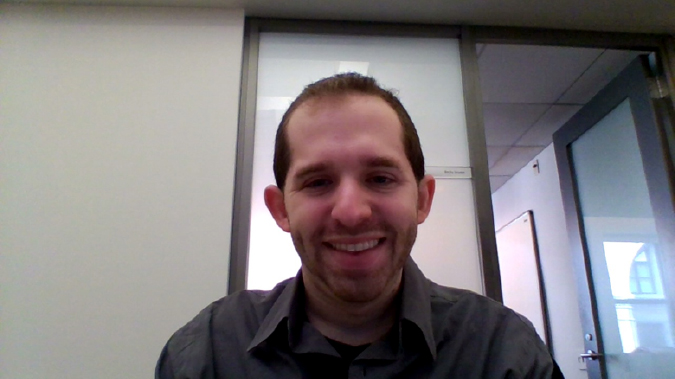
This screenshot has height=379, width=675. Find the location of `lock`. lock is located at coordinates (585, 338).